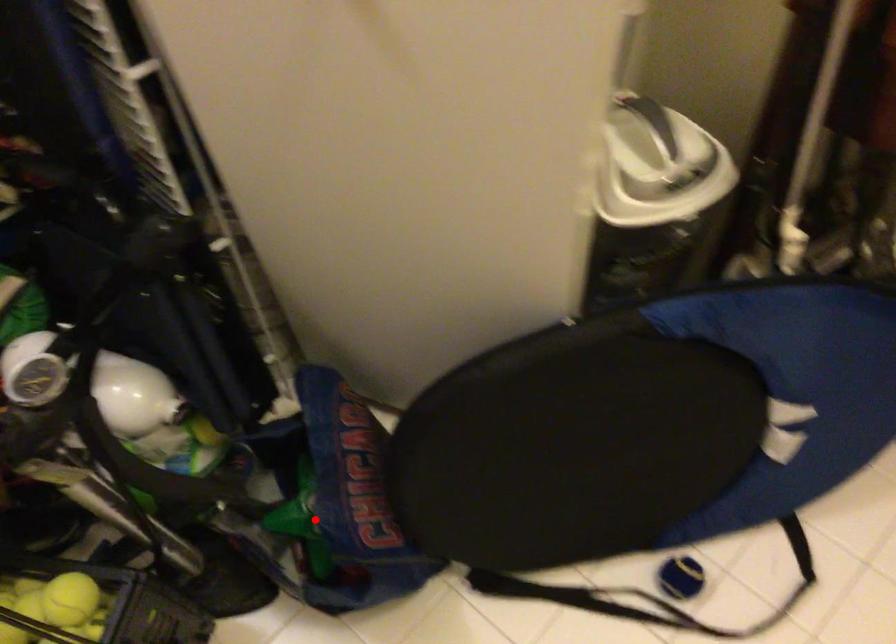
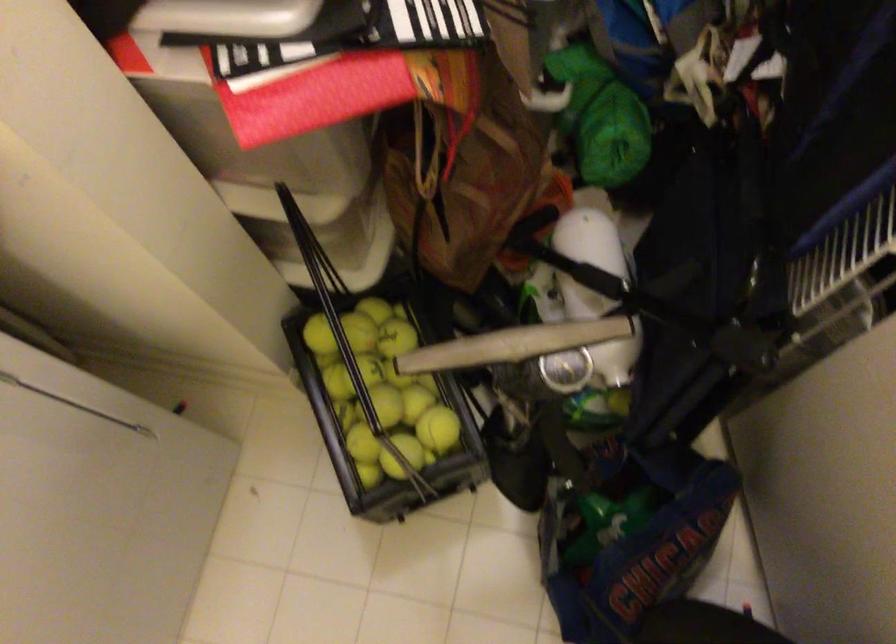
Where in the second image is the point corresponding to the highlighted location from the first image?

(607, 522)